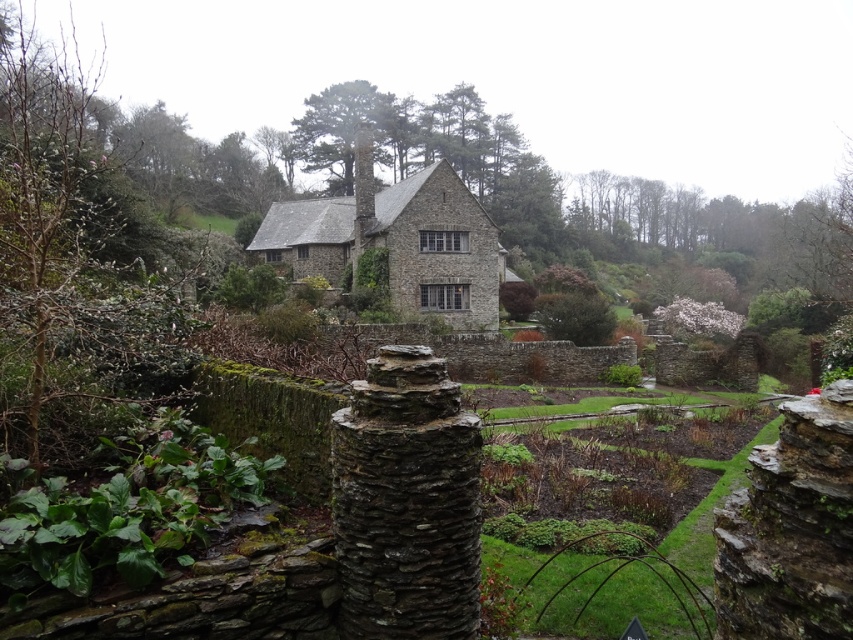
You are a landscape architect designing a walking path between the rustic stone pillar at center and the stone cottage at center. What is the minimum length the path should be to ensure it reaches both points?

The rustic stone pillar at center is 39.27 meters from the stone cottage at center, so the minimum length of the path should be at least 39.27 meters to ensure it reaches both points.

You are standing in front of the stone house and notice a point marked at coordinates [405,500]. What object is located at that point?

The point at coordinates [405,500] indicates the location of the rustic stone pillar at center.